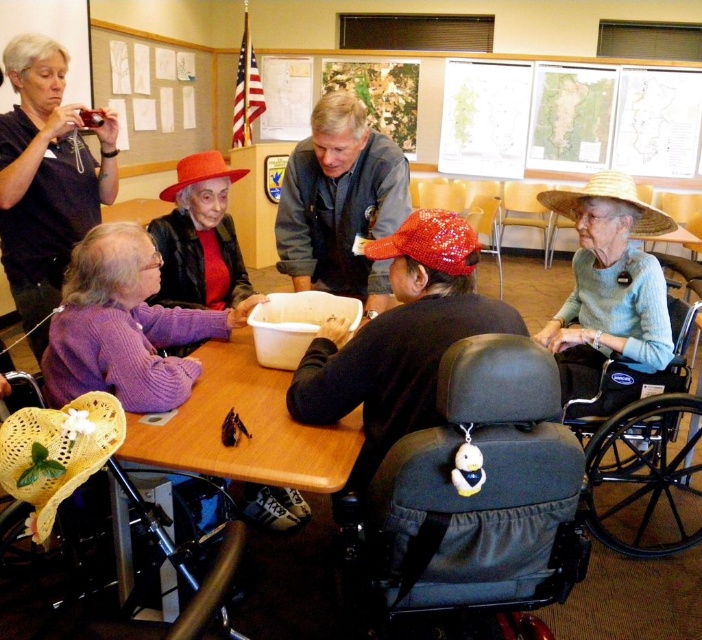
Question: Which object is farther from the camera taking this photo?

Choices:
 (A) black fabric wheelchair at center
 (B) light blue knitted sweater at center right
 (C) knitted red cap at center

Answer: (B)

Question: Which point appears closest to the camera in this image?

Choices:
 (A) (370, 260)
 (B) (311, 364)

Answer: (B)

Question: Does black plastic wheelchair at lower right appear on the left side of yellow woven straw hat at lower left?

Choices:
 (A) yes
 (B) no

Answer: (B)

Question: Which of the following is the farthest from the observer?

Choices:
 (A) (628, 260)
 (B) (357, 109)

Answer: (A)

Question: Is light blue knitted sweater at center right smaller than denim jacket at center?

Choices:
 (A) no
 (B) yes

Answer: (A)

Question: Is the position of black plastic wheelchair at lower right more distant than that of matte red hat at center?

Choices:
 (A) yes
 (B) no

Answer: (A)